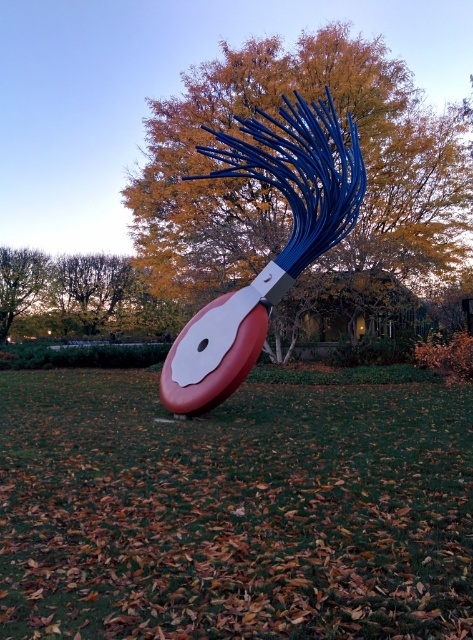
Between green grass at center and brown leafy tree at upper left, which one is positioned higher?

Positioned higher is brown leafy tree at upper left.

Does point (148, 564) come farther from viewer compared to point (26, 289)?

No, (148, 564) is in front of (26, 289).

Find the location of a particular element. Image resolution: width=473 pixels, height=640 pixels. green grass at center is located at coordinates [234, 512].

Identify the location of metallic blue sculpture at center. The height and width of the screenshot is (640, 473). (280, 196).

Can you confirm if metallic blue sculpture at center is thinner than brown leafy tree at upper left?

No, metallic blue sculpture at center is not thinner than brown leafy tree at upper left.

The width and height of the screenshot is (473, 640). In order to click on metallic blue sculpture at center in this screenshot , I will do tap(280, 196).

Looking at this image, which is more to the right, metallic blue brush at center or brown/dry leaves at upper left?

metallic blue brush at center is more to the right.

Measure the distance between metallic blue brush at center and camera.

metallic blue brush at center is 25.05 feet from camera.

Who is more distant from viewer, (225, 300) or (87, 284)?

The point (87, 284) is more distant.

Locate an element on the screen. metallic blue brush at center is located at coordinates click(x=278, y=253).